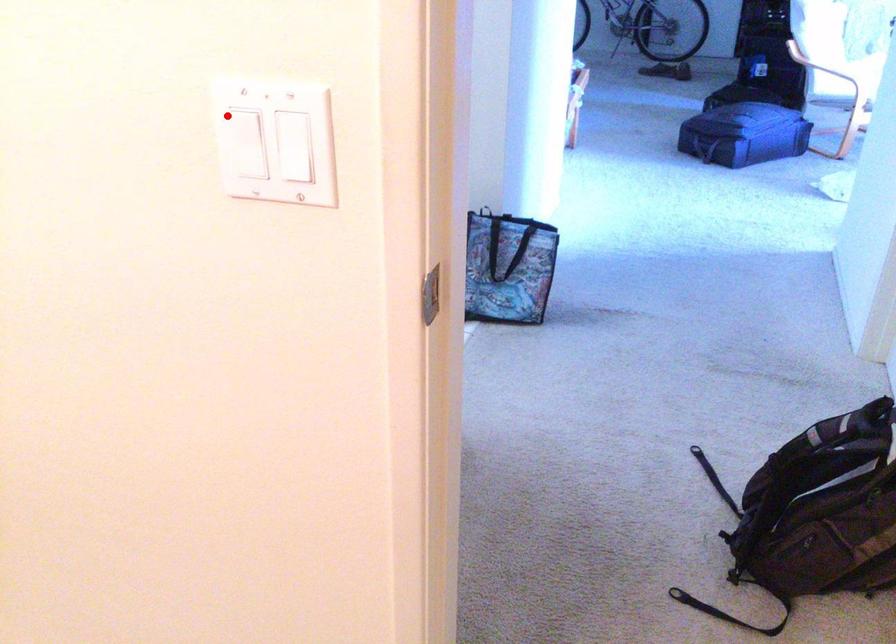
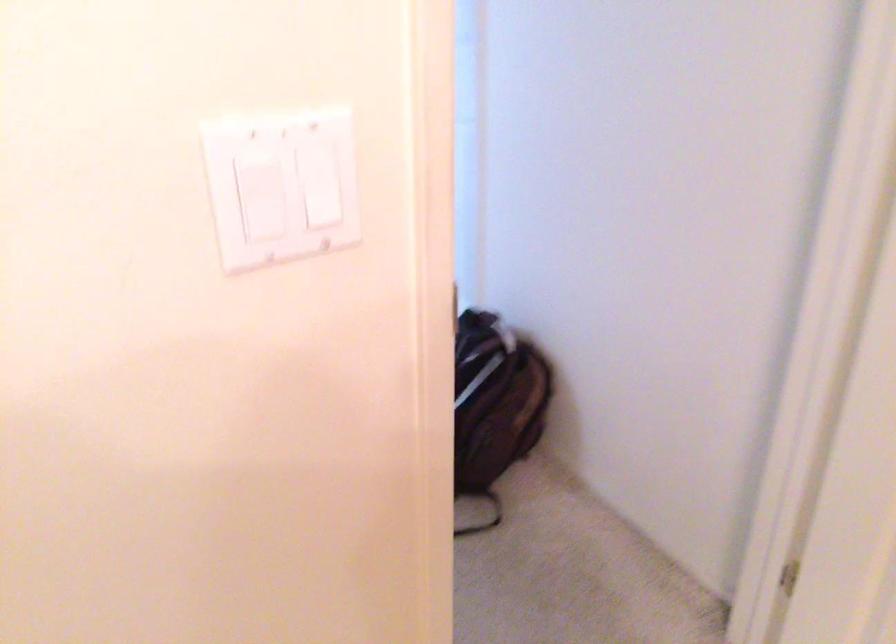
Where in the second image is the point corresponding to the highlighted location from the first image?

(260, 194)